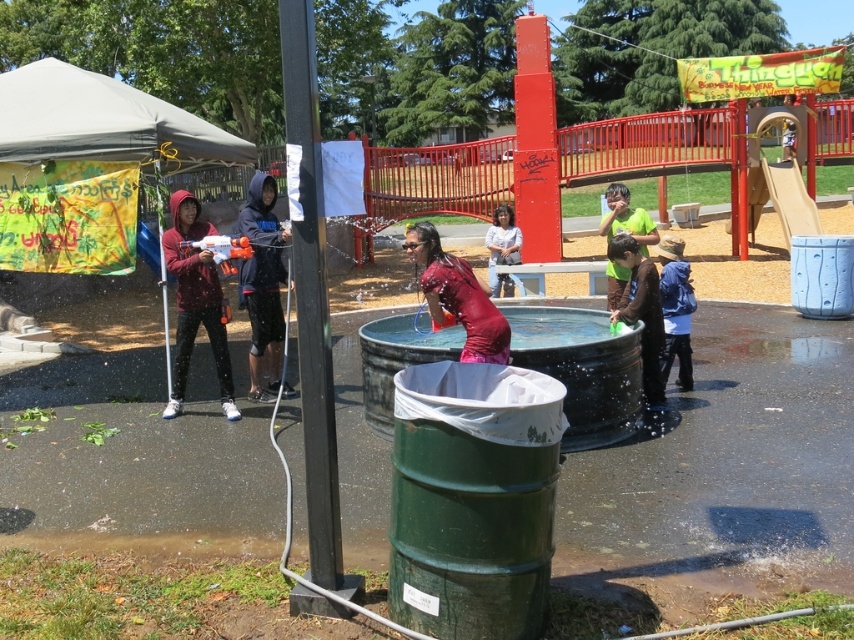
Question: Does matte red hoodie at left appear over matte pink shirt at center?

Choices:
 (A) yes
 (B) no

Answer: (B)

Question: Which of these objects is positioned farthest from the dark blue hoodie at center?

Choices:
 (A) green fabric shirt at lower right
 (B) green matte shirt at center
 (C) blue fleece jacket at lower right
 (D) shiny red dress at center

Answer: (C)

Question: Based on their relative distances, which object is nearer to the shiny red dress at center?

Choices:
 (A) matte pink shirt at center
 (B) matte red hoodie at left

Answer: (B)

Question: Where is dark blue hoodie at center located in relation to green fabric shirt at lower right in the image?

Choices:
 (A) left
 (B) right

Answer: (A)

Question: Is matte red hoodie at left bigger than dark blue hoodie at center?

Choices:
 (A) no
 (B) yes

Answer: (A)

Question: Estimate the real-world distances between objects in this image. Which object is closer to the green matte shirt at center?

Choices:
 (A) dark blue hoodie at center
 (B) shiny red dress at center
 (C) matte red hoodie at left

Answer: (B)